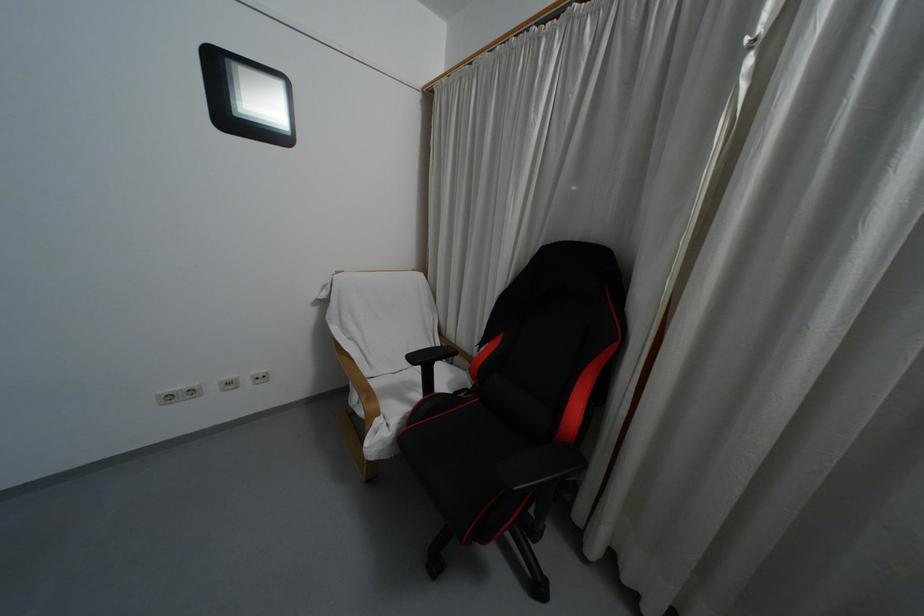
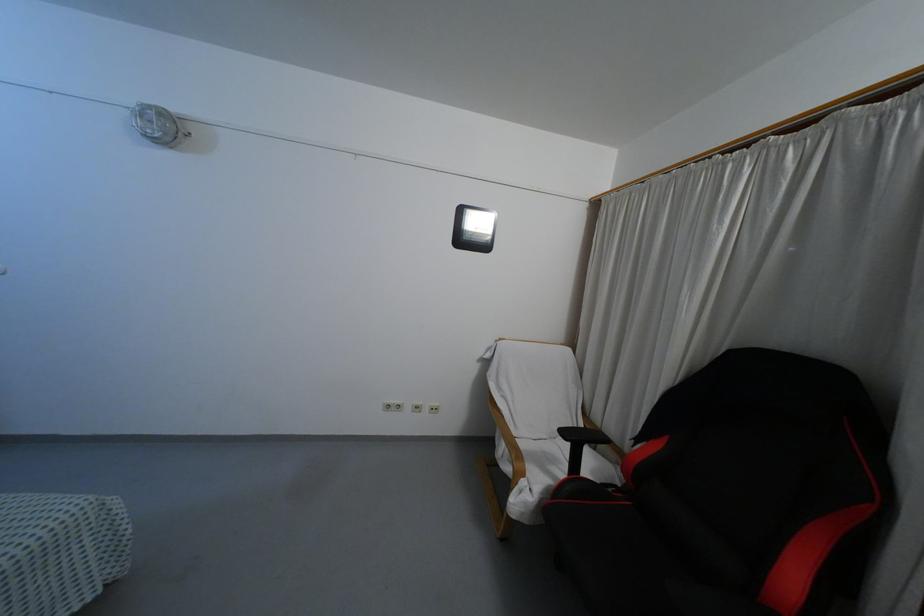
Question: Based on the continuous images, in which direction is the camera rotating? Reply with the corresponding letter.

Choices:
 (A) Left
 (B) Right
 (C) Up
 (D) Down

Answer: (A)